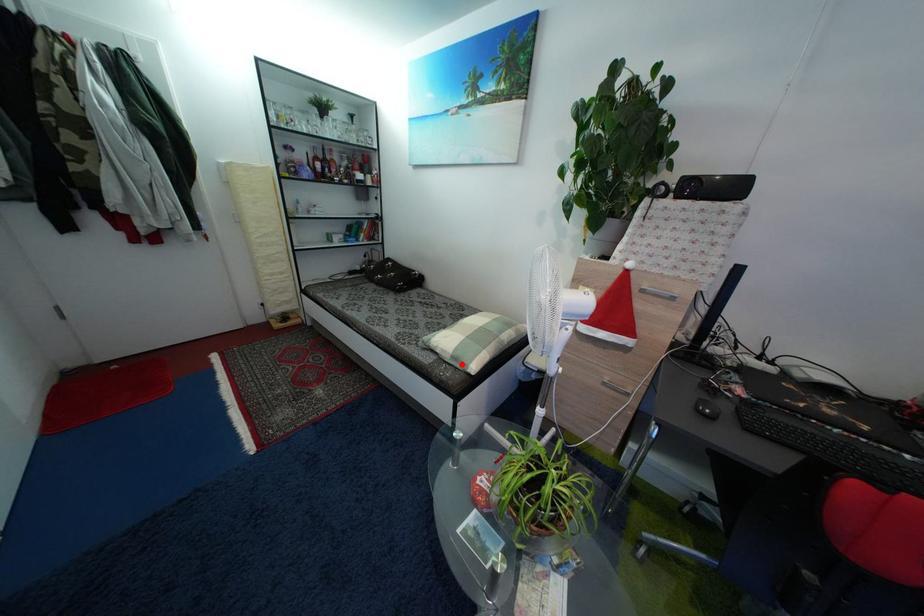
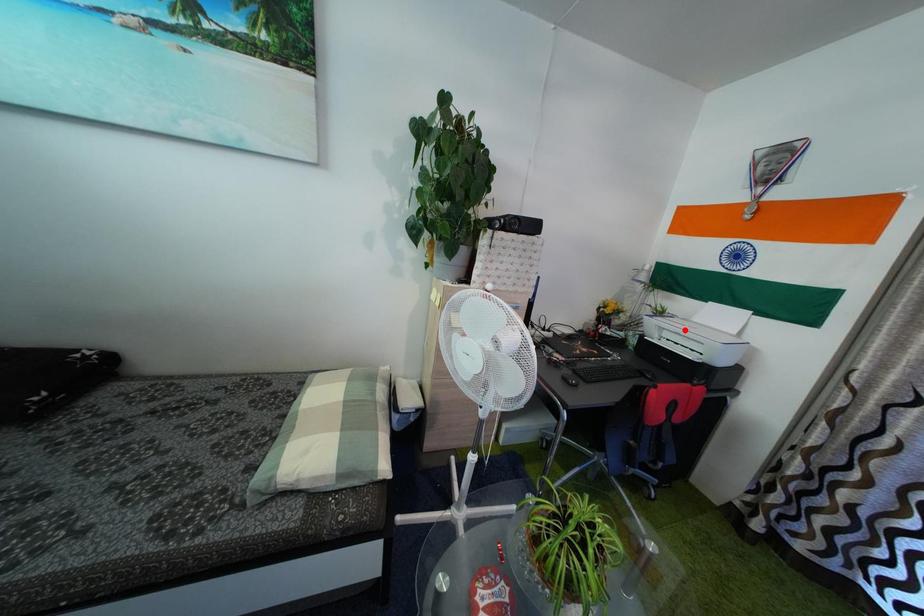
I am providing you with two images of the same scene from different viewpoints. A red point is marked on the first image and another point is marked on the second image. Do the highlighted points in image1 and image2 indicate the same real-world spot?

No